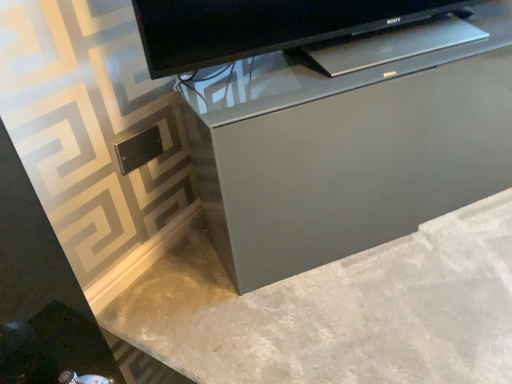
Measure the distance between point (376, 135) and camera.

They are 38.46 inches apart.

Image resolution: width=512 pixels, height=384 pixels. What do you see at coordinates (348, 150) in the screenshot?
I see `satin gray cabinet at center` at bounding box center [348, 150].

Find the location of a particular element. This screenshot has width=512, height=384. satin gray cabinet at center is located at coordinates (348, 150).

In order to click on satin gray cabinet at center in this screenshot , I will do `click(348, 150)`.